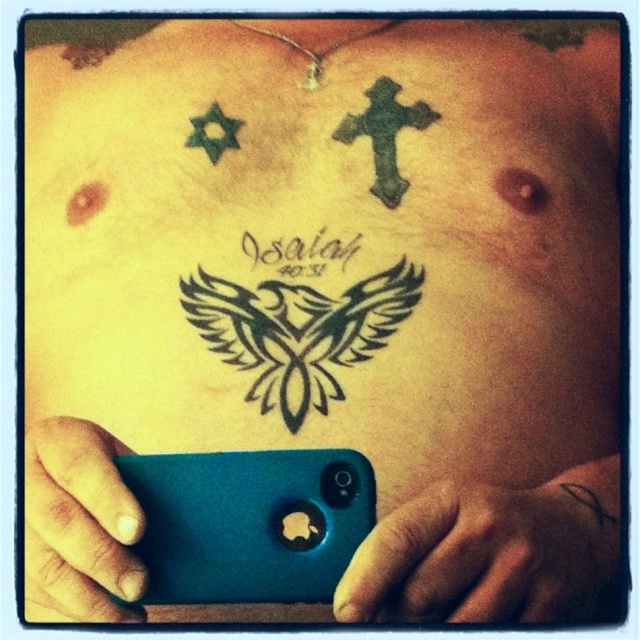
In the scene shown: You are a tattoo artist reviewing a client photo. You need to touch up two points on their chest tattoo. The first point is at location point (x=340, y=250) and the second is at point (x=321, y=536). Which point is closer to the viewer?

Point (x=321, y=536) is closer to the viewer because the Objects Description states that point (x=340, y=250) is behind point (x=321, y=536).